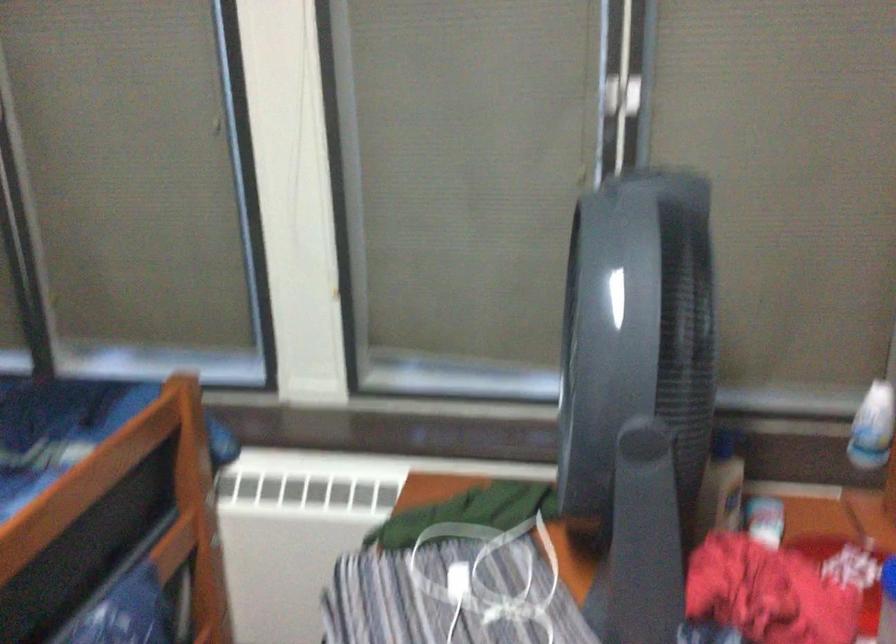
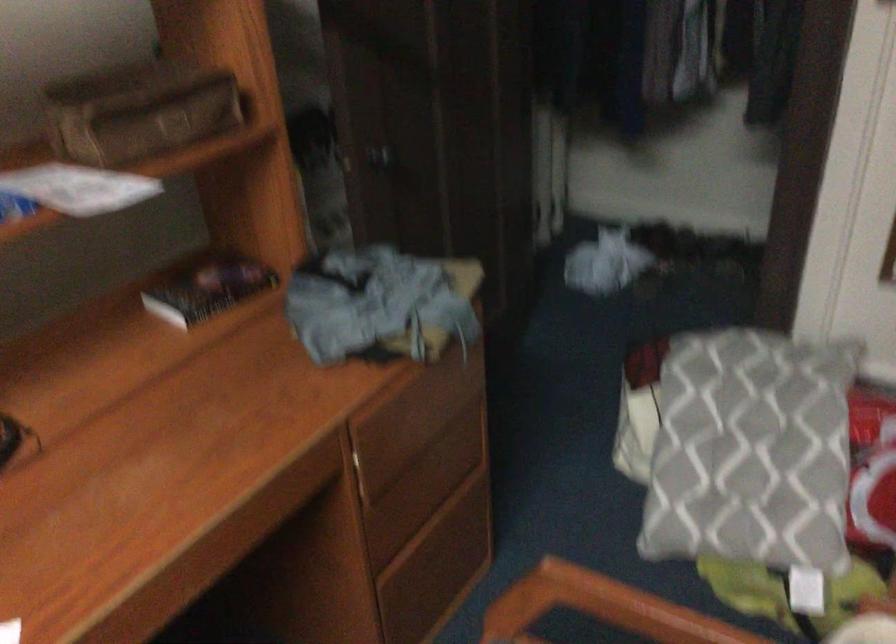
How did the camera likely rotate?

The rotation direction of the camera is right-down.